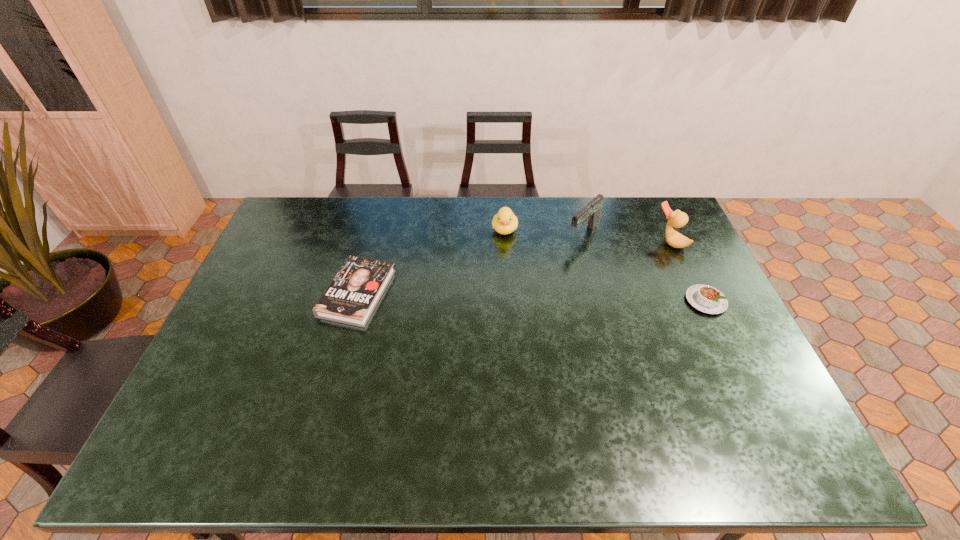
Image resolution: width=960 pixels, height=540 pixels. In order to click on vacant space located on the beak of the duck in this screenshot , I will do `click(589, 291)`.

Where is `vacant area situated on the beak of the duck`? vacant area situated on the beak of the duck is located at coordinates (586, 293).

At what (x,y) coordinates should I click in order to perform the action: click on vacant point located 0.350m aim along the barrel of the pistol. Please return your answer as a coordinate pair (x, y). Image resolution: width=960 pixels, height=540 pixels. Looking at the image, I should click on (513, 302).

I want to click on blank area located aim along the barrel of the pistol, so click(535, 281).

This screenshot has width=960, height=540. What are the coordinates of `free space located 0.250m aim along the barrel of the pistol` in the screenshot? It's located at (532, 284).

At what (x,y) coordinates should I click in order to perform the action: click on vacant space located on the beak of the third tallest object. Please return your answer as a coordinate pair (x, y). Looking at the image, I should click on (498, 285).

Identify the location of free spot located 0.230m on the beak of the third tallest object. (498, 287).

The image size is (960, 540). In order to click on vacant space positioned on the beak of the third tallest object in this screenshot , I will do `click(496, 302)`.

Locate an element on the screen. This screenshot has width=960, height=540. duck that is at the far edge is located at coordinates (x=677, y=219).

What are the coordinates of `pistol at the far edge` in the screenshot? It's located at (591, 212).